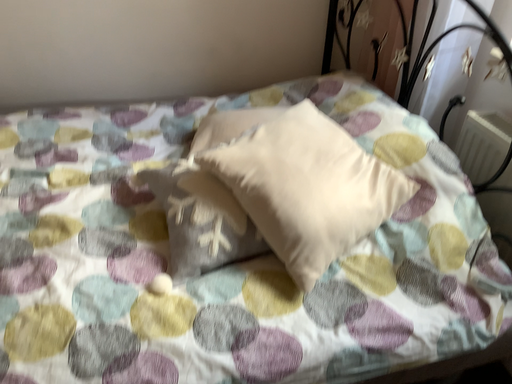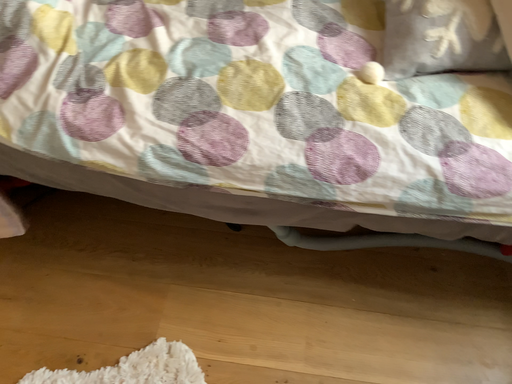
Question: Which way did the camera rotate in the video?

Choices:
 (A) rotated downward
 (B) rotated upward

Answer: (A)